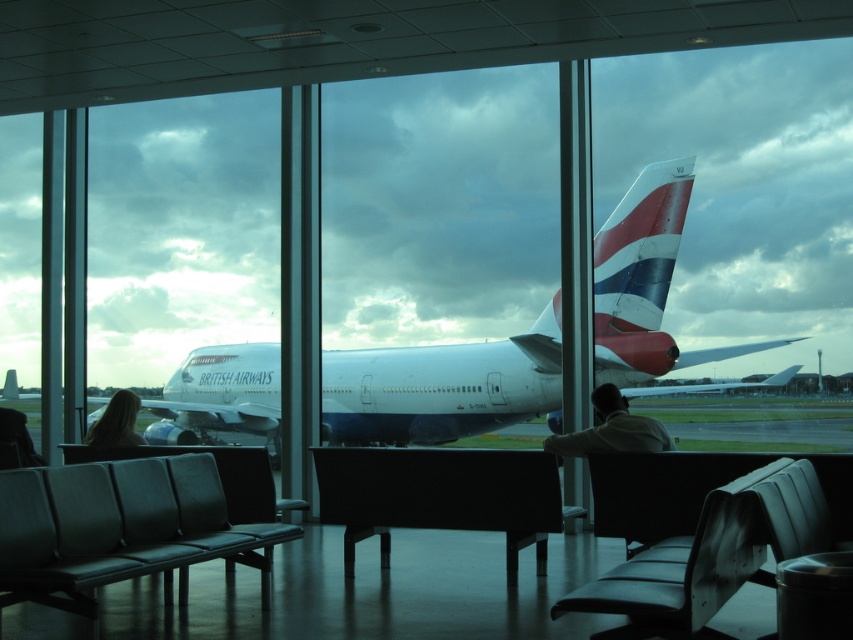
Can you confirm if white glossy airplane at center is positioned to the right of polished aluminum airplane tail at center?

No, white glossy airplane at center is not to the right of polished aluminum airplane tail at center.

Between point (648, 193) and point (660, 262), which one is positioned behind?

The point (648, 193) is behind.

You are a GUI agent. You are given a task and a screenshot of the screen. Output one action in this format:
    pyautogui.click(x=<x>, y=<y>)
    Task: Click on the white glossy airplane at center
    Image resolution: width=853 pixels, height=640 pixels.
    Given the screenshot: What is the action you would take?
    pyautogui.click(x=442, y=387)

Is black fabric chair at center wider than blonde hair at center?

Correct, the width of black fabric chair at center exceeds that of blonde hair at center.

Is black fabric chair at center above blonde hair at center?

No, black fabric chair at center is not above blonde hair at center.

Who is more forward, (360, 460) or (115, 433)?

Positioned in front is point (360, 460).

Locate an element on the screen. black fabric chair at center is located at coordinates (440, 496).

Can you confirm if black fabric chair at center is thinner than metallic silver trash can at lower right?

Incorrect, black fabric chair at center's width is not less than metallic silver trash can at lower right's.

Who is more distant from viewer, (520, 472) or (793, 577)?

Positioned behind is point (520, 472).

Locate an element on the screen. This screenshot has width=853, height=640. black fabric chair at center is located at coordinates (440, 496).